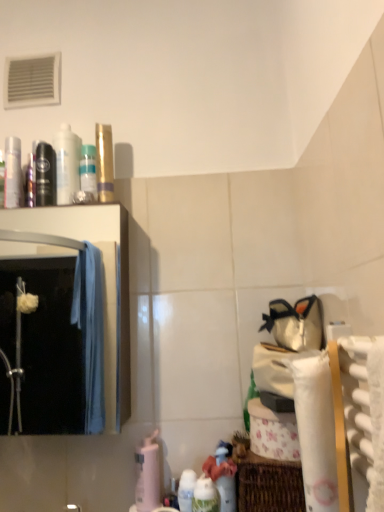
Image resolution: width=384 pixels, height=512 pixels. Describe the element at coordinates (186, 490) in the screenshot. I see `white glossy bottle at lower center, which is counted as the 2th cleaning product, starting from the left` at that location.

The width and height of the screenshot is (384, 512). Identify the location of woven brown basket at lower right. (269, 485).

Can you tell me how much pink matte bottle at lower center, arranged as the 3th cleaning product when viewed from the front, and woven brown basket at lower right differ in facing direction?

The angle between the facing direction of pink matte bottle at lower center, arranged as the 3th cleaning product when viewed from the front, and the facing direction of woven brown basket at lower right is 0.00166 degrees.

Does point (155, 453) appear closer or farther from the camera than point (258, 458)?

Point (155, 453) appears to be farther away from the viewer than point (258, 458).

Is pink matte bottle at lower center, which ranks as the first cleaning product in left-to-right order, located outside woven brown basket at lower right?

pink matte bottle at lower center, which ranks as the first cleaning product in left-to-right order, lies outside woven brown basket at lower right's area.

Is pink matte bottle at lower center, the third cleaning product when ordered from right to left, bigger than woven brown basket at lower right?

No, pink matte bottle at lower center, the third cleaning product when ordered from right to left, is not bigger than woven brown basket at lower right.

Between woven brown basket at lower right and pink matte bottle at lower center, the third cleaning product when ordered from right to left, which one is positioned behind?

Positioned behind is pink matte bottle at lower center, the third cleaning product when ordered from right to left.

Is woven brown basket at lower right inside or outside of pink matte bottle at lower center, the third cleaning product when ordered from right to left?

woven brown basket at lower right cannot be found inside pink matte bottle at lower center, the third cleaning product when ordered from right to left.

Can you see woven brown basket at lower right touching pink matte bottle at lower center, which ranks as the first cleaning product in left-to-right order?

There is a gap between woven brown basket at lower right and pink matte bottle at lower center, which ranks as the first cleaning product in left-to-right order.

How different are the orientations of woven brown basket at lower right and pink matte bottle at lower center, which ranks as the first cleaning product in back-to-front order, in degrees?

woven brown basket at lower right and pink matte bottle at lower center, which ranks as the first cleaning product in back-to-front order, are facing 0.00166 degrees away from each other.

Can translucent plastic bottle at upper center, which is counted as the fourth mouthwash, starting from the left, be found inside white glossy bottle at lower center, arranged as the third cleaning product when viewed from the left?

No, translucent plastic bottle at upper center, which is counted as the fourth mouthwash, starting from the left, is not a part of white glossy bottle at lower center, arranged as the third cleaning product when viewed from the left.

Which point is more forward, (202,510) or (88,174)?

Positioned in front is point (202,510).

Can you confirm if white glossy bottle at lower center, the first cleaning product from the front, is thinner than translucent plastic bottle at upper center, which is counted as the fourth mouthwash, starting from the left?

No, white glossy bottle at lower center, the first cleaning product from the front, is not thinner than translucent plastic bottle at upper center, which is counted as the fourth mouthwash, starting from the left.

Can you tell me how much woven brown basket at lower right and white paper towel at lower right differ in facing direction?

90 degrees separate the facing orientations of woven brown basket at lower right and white paper towel at lower right.

Does woven brown basket at lower right turn towards white paper towel at lower right?

Yes.

Is woven brown basket at lower right inside the boundaries of white paper towel at lower right, or outside?

woven brown basket at lower right is not enclosed by white paper towel at lower right.

Is woven brown basket at lower right beside white paper towel at lower right?

woven brown basket at lower right and white paper towel at lower right are clearly separated.

Consider the image. Considering the sizes of objects translucent plastic bottle at upper center, which is counted as the fourth mouthwash, starting from the left, and white glossy bottle at upper left, which appears as the second mouthwash when viewed from the right, in the image provided, who is shorter, translucent plastic bottle at upper center, which is counted as the fourth mouthwash, starting from the left, or white glossy bottle at upper left, which appears as the second mouthwash when viewed from the right,?

translucent plastic bottle at upper center, which is counted as the fourth mouthwash, starting from the left, is shorter.

Is translucent plastic bottle at upper center, which is counted as the fourth mouthwash, starting from the left, further to the viewer compared to white glossy bottle at upper left, which ranks as the third mouthwash in left-to-right order?

Yes, translucent plastic bottle at upper center, which is counted as the fourth mouthwash, starting from the left, is further from the viewer.

Is translucent plastic bottle at upper center, which is counted as the fourth mouthwash, starting from the left, touching white glossy bottle at upper left, which appears as the second mouthwash when viewed from the right?

Indeed, translucent plastic bottle at upper center, which is counted as the fourth mouthwash, starting from the left, and white glossy bottle at upper left, which appears as the second mouthwash when viewed from the right, are beside each other and touching.

Does point (91, 177) come closer to viewer compared to point (76, 177)?

Yes.

Can you confirm if white glossy bottle at lower center, which is the second cleaning product from back to front, is shorter than white textured bath towel at right?

Yes, white glossy bottle at lower center, which is the second cleaning product from back to front, is shorter than white textured bath towel at right.

Considering the relative sizes of white glossy bottle at lower center, which is the 2th cleaning product from front to back, and white textured bath towel at right in the image provided, is white glossy bottle at lower center, which is the 2th cleaning product from front to back, thinner than white textured bath towel at right?

Yes, white glossy bottle at lower center, which is the 2th cleaning product from front to back, is thinner than white textured bath towel at right.

Would you say white glossy bottle at lower center, which is counted as the 2th cleaning product, starting from the left, is outside white textured bath towel at right?

Yes, white glossy bottle at lower center, which is counted as the 2th cleaning product, starting from the left, is outside of white textured bath towel at right.

Considering the relative sizes of white glossy bottle at upper left, which ranks as the third mouthwash in left-to-right order, and white textured bath towel at right in the image provided, is white glossy bottle at upper left, which ranks as the third mouthwash in left-to-right order, taller than white textured bath towel at right?

Yes, white glossy bottle at upper left, which ranks as the third mouthwash in left-to-right order, is taller than white textured bath towel at right.

From the image's perspective, which is above, white glossy bottle at upper left, which appears as the second mouthwash when viewed from the right, or white textured bath towel at right?

From the image's view, white glossy bottle at upper left, which appears as the second mouthwash when viewed from the right, is above.

From a real-world perspective, is white glossy bottle at upper left, which ranks as the third mouthwash in left-to-right order, physically located above or below white textured bath towel at right?

white glossy bottle at upper left, which ranks as the third mouthwash in left-to-right order, is situated higher than white textured bath towel at right in the real world.

Can white textured bath towel at right be found inside white glossy bottle at upper left, which ranks as the third mouthwash in left-to-right order?

No, white glossy bottle at upper left, which ranks as the third mouthwash in left-to-right order, does not contain white textured bath towel at right.

Identify the location of basket on the right of pink matte bottle at lower center, arranged as the 3th cleaning product when viewed from the front. (269, 485).

Where is `cleaning product above the woven brown basket at lower right (from a real-world perspective)`? This screenshot has height=512, width=384. cleaning product above the woven brown basket at lower right (from a real-world perspective) is located at coordinates (147, 474).

Considering their positions, is black matte mouthwash at left, which is the 3th mouthwash in right-to-left order, positioned closer to white paper towel at lower right than translucent plastic bottle at upper center, which is counted as the fourth mouthwash, starting from the left?

translucent plastic bottle at upper center, which is counted as the fourth mouthwash, starting from the left, lies closer to white paper towel at lower right than the other object.

Which object lies nearer to the anchor point clear glass mirror at left, pink matte bottle at lower center, arranged as the 3th cleaning product when viewed from the front, or white glossy bottle at lower center, arranged as the third cleaning product when viewed from the left?

Based on the image, pink matte bottle at lower center, arranged as the 3th cleaning product when viewed from the front, appears to be nearer to clear glass mirror at left.

From the image, which object appears to be farther from metallic silver mouthwash at left, marked as the 1th mouthwash in a left-to-right arrangement, white glossy bottle at lower center, which is counted as the 2th cleaning product, starting from the left, or gold metallic tube at upper center?

white glossy bottle at lower center, which is counted as the 2th cleaning product, starting from the left.

Looking at the image, which one is located further to gold metallic tube at upper center, metallic silver mouthwash at left, marked as the 1th mouthwash in a left-to-right arrangement, or white paper towel at lower right?

The object further to gold metallic tube at upper center is white paper towel at lower right.

Which object lies further to the anchor point black matte mouthwash at left, which is the 3th mouthwash in right-to-left order, clear glass mirror at left or gold metallic tube at upper center?

Among the two, clear glass mirror at left is located further to black matte mouthwash at left, which is the 3th mouthwash in right-to-left order.

From the image, which object appears to be nearer to clear glass mirror at left, woven brown basket at lower right or white paper towel at lower right?

woven brown basket at lower right is closer to clear glass mirror at left.

Which object lies nearer to the anchor point white glossy bottle at lower center, arranged as the third cleaning product when viewed from the left, black matte mouthwash at left, the second mouthwash viewed from the left, or white glossy bottle at lower center, which is the 2th cleaning product from front to back?

white glossy bottle at lower center, which is the 2th cleaning product from front to back, is closer to white glossy bottle at lower center, arranged as the third cleaning product when viewed from the left.

Which object lies nearer to the anchor point metallic silver mouthwash at left, placed as the fourth mouthwash when sorted from right to left, white glossy bottle at upper left, which appears as the second mouthwash when viewed from the right, or translucent plastic bottle at upper center, placed as the 1th mouthwash when sorted from right to left?

Based on the image, white glossy bottle at upper left, which appears as the second mouthwash when viewed from the right, appears to be nearer to metallic silver mouthwash at left, placed as the fourth mouthwash when sorted from right to left.

I want to click on basket between white textured bath towel at right and white glossy bottle at lower center, the second cleaning product from the right, from front to back, so click(269, 485).

Where is `basket between black matte mouthwash at left, which is the 3th mouthwash in right-to-left order, and white glossy bottle at lower center, which is counted as the 2th cleaning product, starting from the left, in the vertical direction`? Image resolution: width=384 pixels, height=512 pixels. basket between black matte mouthwash at left, which is the 3th mouthwash in right-to-left order, and white glossy bottle at lower center, which is counted as the 2th cleaning product, starting from the left, in the vertical direction is located at coordinates (269, 485).

This screenshot has height=512, width=384. In order to click on toilet paper between gold metallic tube at upper center and woven brown basket at lower right from top to bottom in this screenshot , I will do `click(316, 429)`.

I want to click on cleaning product between gold metallic tube at upper center and white glossy bottle at lower center, the first cleaning product from the front, in the vertical direction, so click(147, 474).